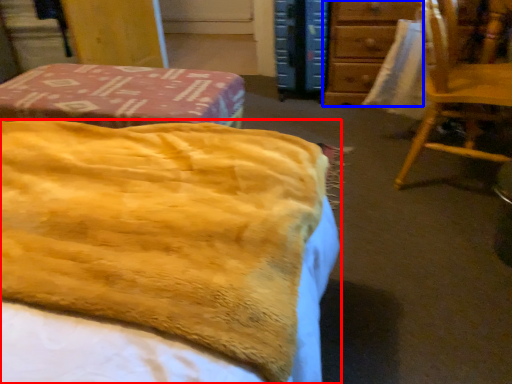
Question: Among these objects, which one is farthest to the camera, bed (highlighted by a red box) or furniture (highlighted by a blue box)?

Choices:
 (A) bed
 (B) furniture

Answer: (B)